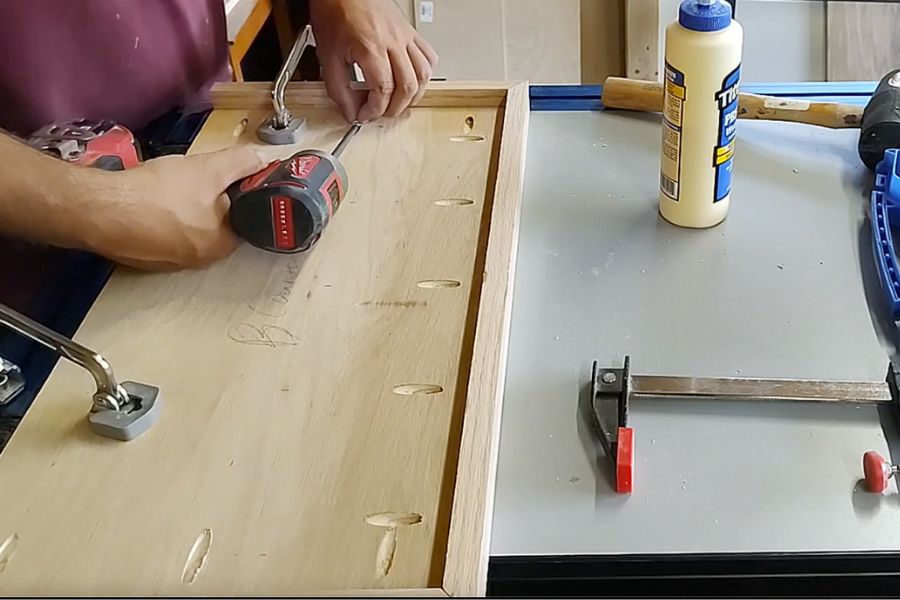
Where is `gouge in wood`? gouge in wood is located at coordinates coord(399,513).